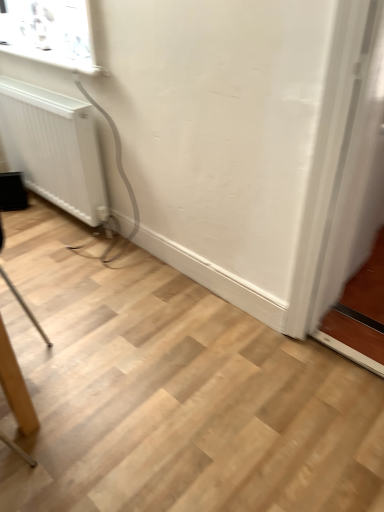
Locate an element on the screen. This screenshot has height=512, width=384. free point in front of white matte radiator at left is located at coordinates (65, 254).